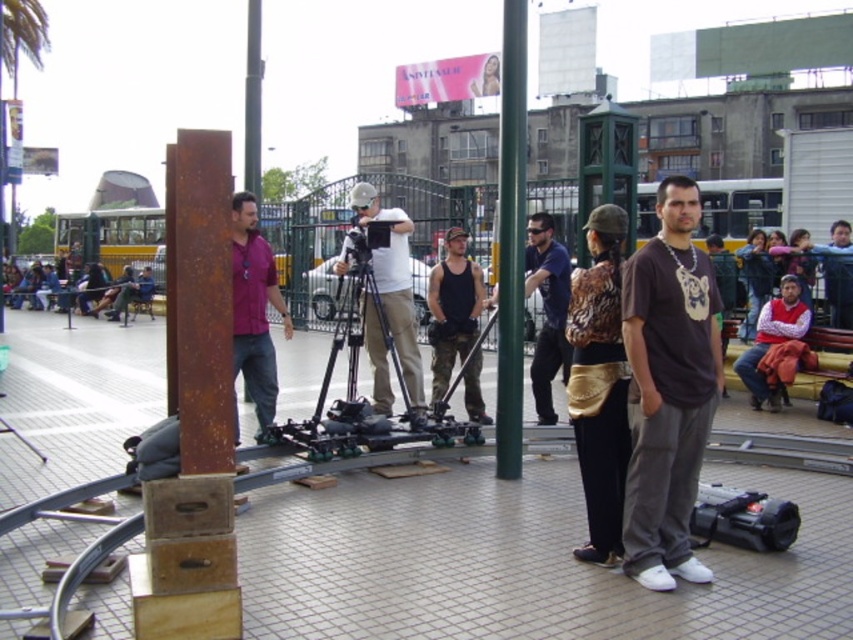
You are a costume designer looking for the leopard print jacket at center and the black rubber camera at lower right on set. Which item should you pick up first if you want to handle the larger object first?

The leopard print jacket at center is larger in size than the black rubber camera at lower right, so you should pick up the leopard print jacket at center first.

You are a film crew member who needs to retrieve the leopard print jacket at center and the black rubber camera at lower right for the next scene. If your backpack can only carry items within 4 feet of each other, will you be able to carry both items together?

The leopard print jacket at center and the black rubber camera at lower right are 4.25 feet apart. Since the backpack can only carry items within 4 feet of each other, the distance exceeds the limit. Therefore, you cannot carry both items together.

You are a film crew member who needs to set up a light stand between the rusty metal pole at center and the matte white camera at center. Given that the light stand requires 1 meter of space, can you determine if there is enough space between them?

The rusty metal pole at center has a smaller size compared to matte white camera at center, but the exact distance between them isn not provided in the scene description. Therefore, it is unclear if there is sufficient space for the light stand requiring 1 meter.